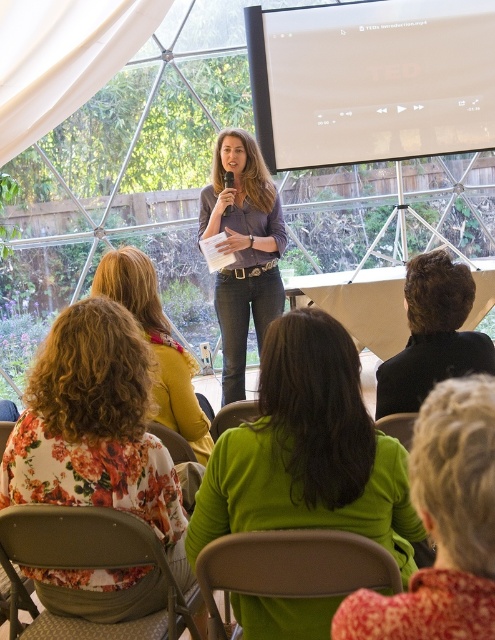
In the geodesic dome presentation scene, there are two people at the center wearing a green matte sweater and a matte purple shirt. From the speaker at the front, which direction is the green matte sweater at center relative to the matte purple shirt at center?

The green matte sweater at center is to the right of the matte purple shirt at center.

You are an attendee at the presentation and notice two green items at the center of the dome. One is the green matte sweater at center and the other is the green fabric at center. Which of these two items is taller?

The green matte sweater at center is taller than the green fabric at center.